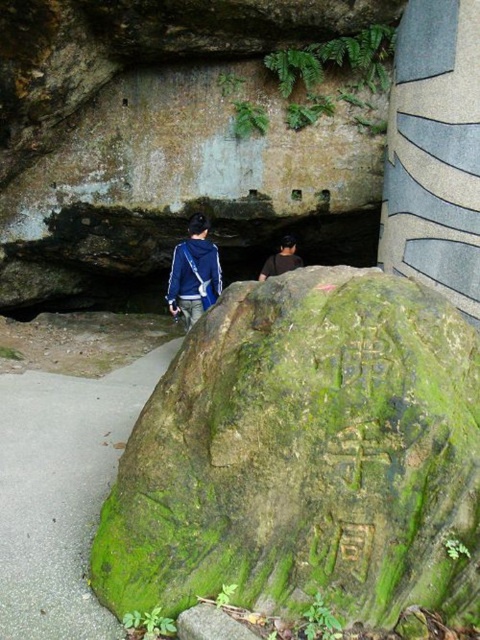
Which is more to the right, green mossy rock at center or dark brown leather jacket at center?

Positioned to the right is dark brown leather jacket at center.

Is point (272, 490) farther from camera compared to point (289, 243)?

No, (272, 490) is closer to viewer.

This screenshot has height=640, width=480. In order to click on green mossy rock at center in this screenshot , I will do `click(305, 456)`.

Does blue fabric jacket at center lie in front of dark brown leather jacket at center?

Yes, it is in front of dark brown leather jacket at center.

Is point (183, 298) farther from viewer compared to point (285, 252)?

No, (183, 298) is closer to viewer.

Identify the location of blue fabric jacket at center. [x=193, y=273].

Does green mossy rock at center appear over blue fabric jacket at center?

No, green mossy rock at center is not above blue fabric jacket at center.

Is green mossy rock at center thinner than blue fabric jacket at center?

Incorrect, green mossy rock at center's width is not less than blue fabric jacket at center's.

Which is in front, point (282, 340) or point (205, 292)?

Point (282, 340)

Where is `green mossy rock at center`? green mossy rock at center is located at coordinates (305, 456).